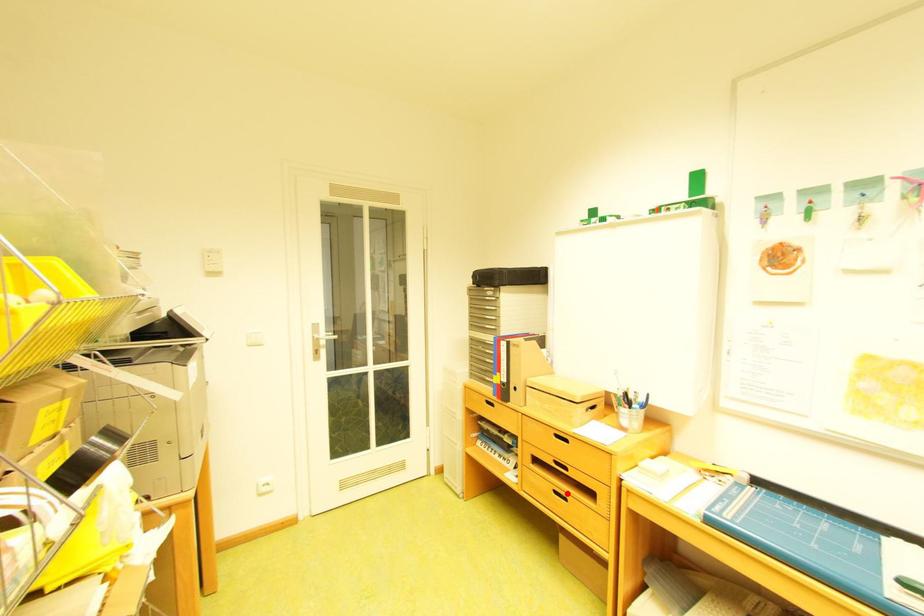
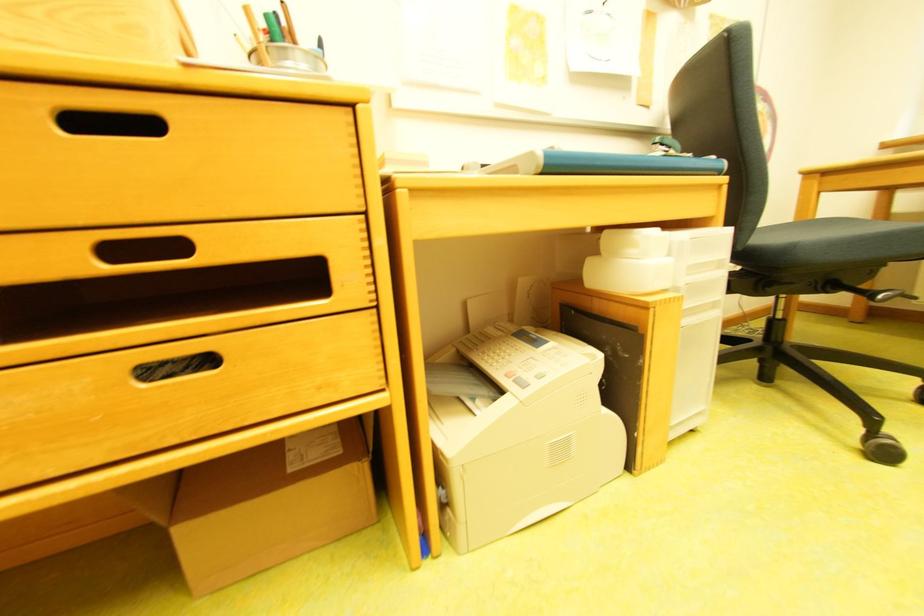
Where in the second image is the point corresponding to the highlighted location from the first image?

(162, 374)